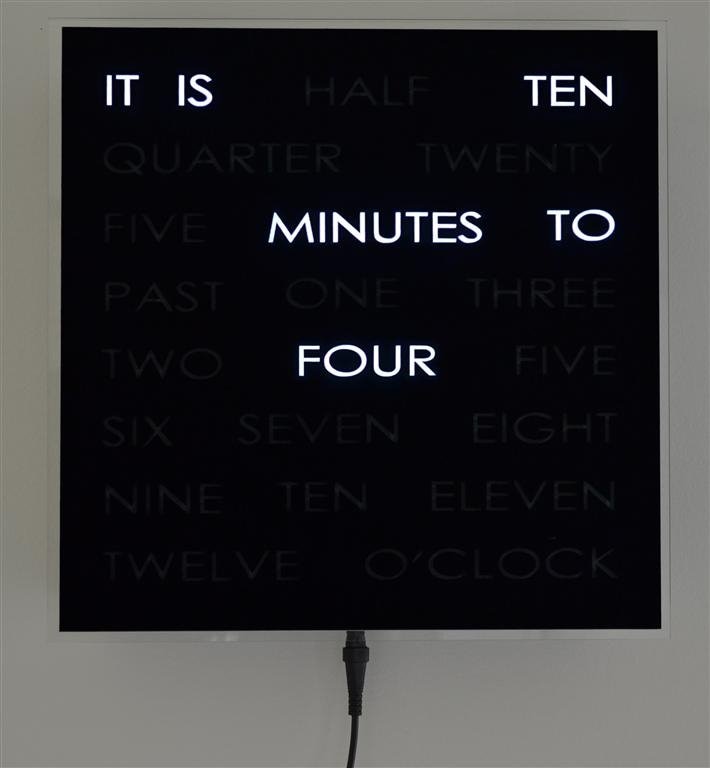
Identify the location of plug. (353, 660).